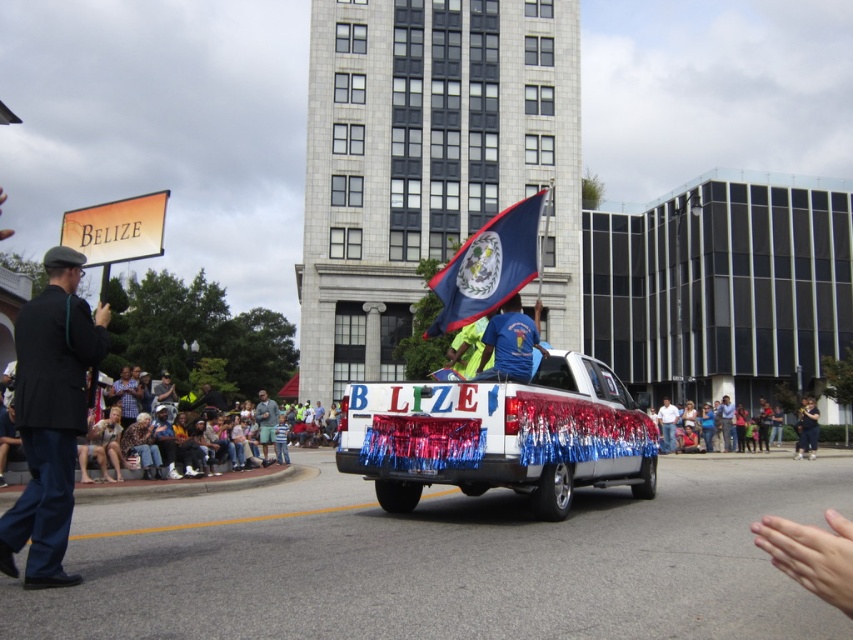
Which is more to the right, checkered fabric shirt at center or light blue denim shorts at center?

checkered fabric shirt at center

Which is in front, point (120, 369) or point (258, 394)?

Point (120, 369)

Where is `checkered fabric shirt at center`? This screenshot has height=640, width=853. checkered fabric shirt at center is located at coordinates (126, 396).

Is dark blue uniform at left shorter than dark blue denim jacket at lower right?

No, dark blue uniform at left is not shorter than dark blue denim jacket at lower right.

Can you confirm if dark blue uniform at left is taller than dark blue denim jacket at lower right?

Yes, dark blue uniform at left is taller than dark blue denim jacket at lower right.

Which is behind, point (83, 396) or point (805, 417)?

Positioned behind is point (805, 417).

Find the location of a particular element. The image size is (853, 640). dark blue uniform at left is located at coordinates (50, 417).

Does point (604, 484) lie behind point (277, 412)?

No, it is in front of (277, 412).

Which is more to the right, shiny metallic truck at center or light blue denim shorts at center?

shiny metallic truck at center

Locate an element on the screen. This screenshot has height=640, width=853. shiny metallic truck at center is located at coordinates (500, 435).